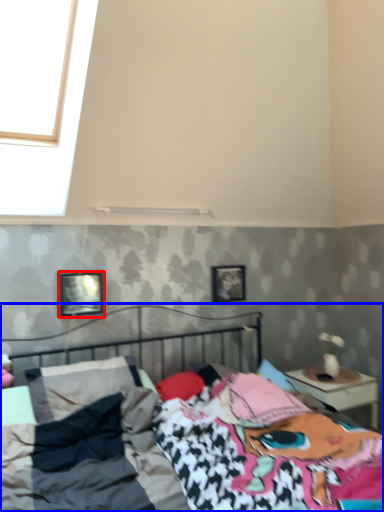
Question: Which object is closer to the camera taking this photo, picture frame (highlighted by a red box) or bed (highlighted by a blue box)?

Choices:
 (A) picture frame
 (B) bed

Answer: (B)